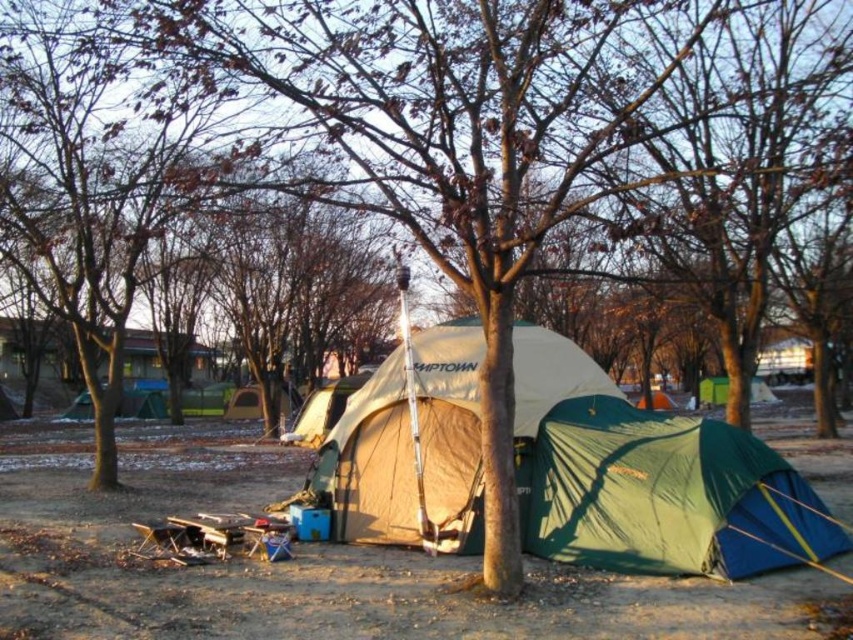
You are setting up a campsite and need to place a new tent. You have two existing tents, the green fabric tent at lower right and the beige fabric tent at center. Which tent is positioned to the right side of the other?

The green fabric tent at lower right is to the right of the beige fabric tent at center.

You are planning to set up a tent in this camping area. You have two tents available, the green fabric tent at lower right and the beige fabric tent at center. Which tent should you choose if you want the larger one for more space?

The beige fabric tent at center is larger than the green fabric tent at lower right, so you should choose the beige fabric tent at center for more space.